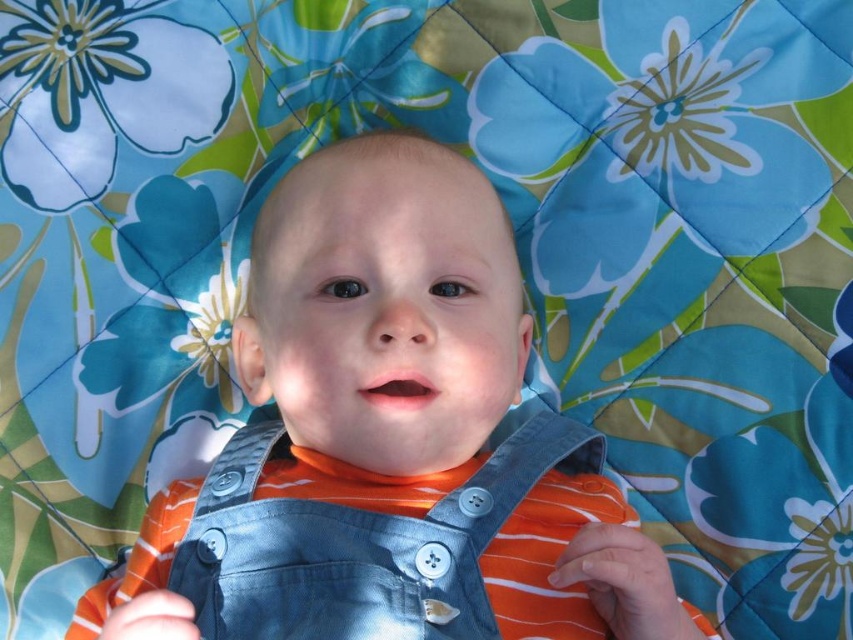
You are a photographer setting up a shot of the baby. The denim overalls at center and the denim bib at center are both in the frame. If you want to focus on the wider object, which one should you adjust your camera to capture?

The denim overalls at center is wider than the denim bib at center, so you should adjust your camera to capture the denim overalls at center.

You are a photographer trying to capture the baby in the scene. You want to ensure both the denim overalls at center and the denim bib at center are visible in the frame. Based on their positions, which one should you focus on first to ensure both are in the shot?

The denim overalls at center is to the left of the denim bib at center. To ensure both are in the shot, focus on the denim overalls at center first since it is positioned to the left, allowing the photographer to frame from left to right.